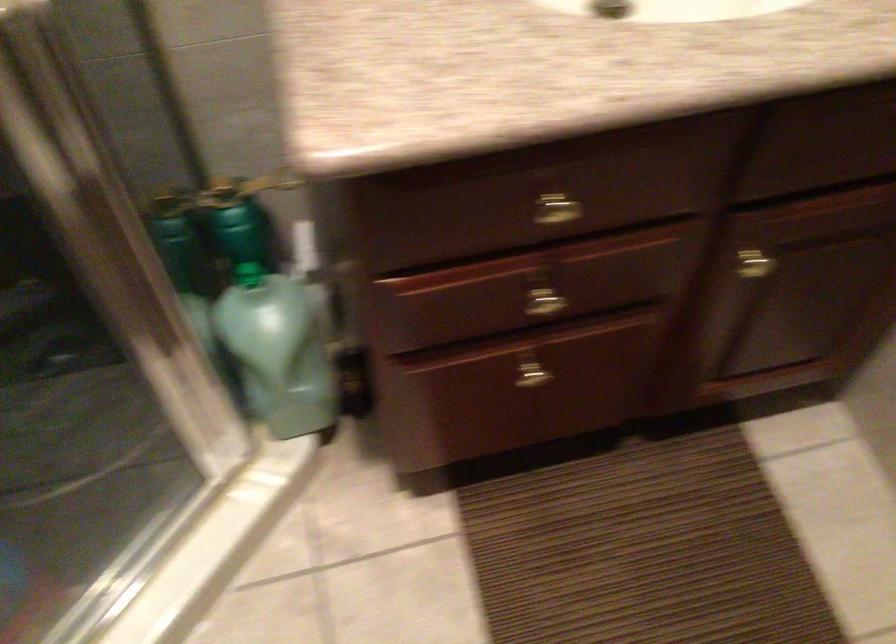
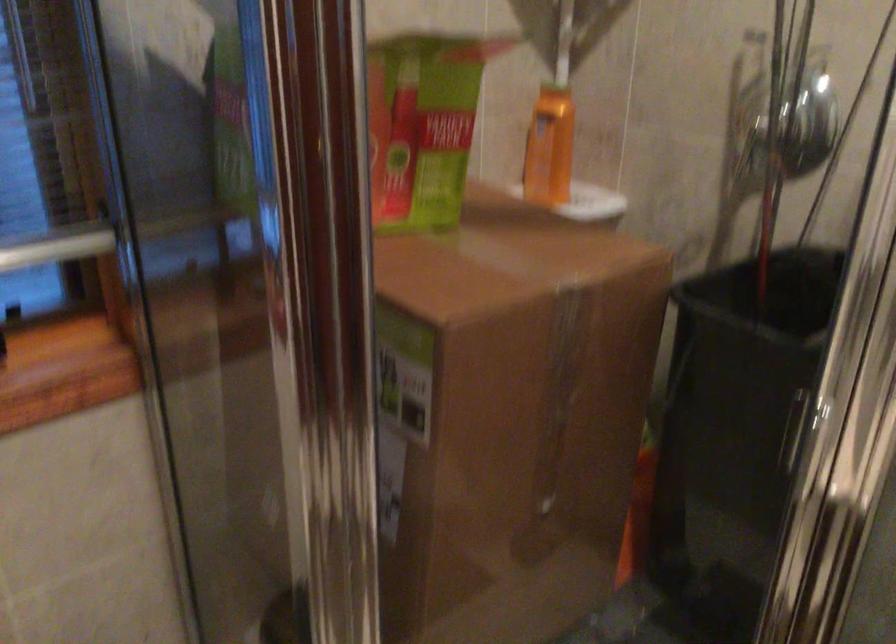
Question: Based on the continuous images, in which direction is the camera rotating? Reply with the corresponding letter.

Choices:
 (A) Left
 (B) Right
 (C) Up
 (D) Down

Answer: (A)